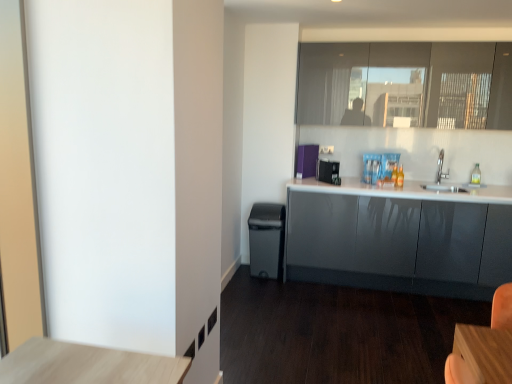
Find the location of `matte black trash can at lower center`. matte black trash can at lower center is located at coordinates (266, 240).

In order to face transparent plastic bottle at right, should I rotate leftwards or rightwards?

Rotate right and turn 27.560 degrees.

Where is `glossy gray cabinets at right`? glossy gray cabinets at right is located at coordinates (399, 238).

What do you see at coordinates (329, 171) in the screenshot? I see `black plastic toaster at center, the second appliance in the back-to-front sequence` at bounding box center [329, 171].

What is the approximate width of silver metallic sink at upper right?

11.90 inches.

This screenshot has height=384, width=512. What do you see at coordinates (442, 178) in the screenshot? I see `silver metallic sink at upper right` at bounding box center [442, 178].

Locate an element on the screen. The image size is (512, 384). matte black trash can at lower center is located at coordinates (266, 240).

Is black plastic toaster at center, the second appliance in the back-to-front sequence, placed right next to silver metallic sink at upper right?

black plastic toaster at center, the second appliance in the back-to-front sequence, is not next to silver metallic sink at upper right, and they're not touching.

Who is shorter, black plastic toaster at center, the second appliance in the back-to-front sequence, or silver metallic sink at upper right?

black plastic toaster at center, the second appliance in the back-to-front sequence, is shorter.

How much distance is there between black plastic toaster at center, the second appliance in the back-to-front sequence, and silver metallic sink at upper right?

They are 36.63 inches apart.

Would you say black plastic toaster at center, the second appliance in the back-to-front sequence, is outside silver metallic sink at upper right?

Yes.

This screenshot has height=384, width=512. Identify the location of appliance that is the 1st one when counting upward from the glossy gray cabinets at right (from the image's perspective). (329, 171).

In terms of width, does glossy gray cabinets at right look wider or thinner when compared to black plastic toaster at center, the second appliance in the back-to-front sequence?

glossy gray cabinets at right is wider than black plastic toaster at center, the second appliance in the back-to-front sequence.

Is the position of glossy gray cabinets at right more distant than that of black plastic toaster at center, the second appliance in the back-to-front sequence?

No, the depth of glossy gray cabinets at right is less than that of black plastic toaster at center, the second appliance in the back-to-front sequence.

Locate an element on the screen. Image resolution: width=512 pixels, height=384 pixels. dish washer below the silver metallic sink at upper right (from the image's perspective) is located at coordinates (266, 240).

Which point is more forward, (283,225) or (441,161)?

Point (283,225)

Who is taller, matte black trash can at lower center or silver metallic sink at upper right?

matte black trash can at lower center.

Measure the distance from purple fabric at upper center, positioned as the 2th appliance in front-to-back order, to matte glass window at upper right.

A distance of 37.42 inches exists between purple fabric at upper center, positioned as the 2th appliance in front-to-back order, and matte glass window at upper right.

From the picture: Which object is closer to the camera, purple fabric at upper center, which ranks as the 1th appliance in back-to-front order, or matte glass window at upper right?

matte glass window at upper right is in front.

Which object is thinner, purple fabric at upper center, positioned as the 2th appliance in front-to-back order, or matte glass window at upper right?

With smaller width is purple fabric at upper center, positioned as the 2th appliance in front-to-back order.

From a real-world perspective, who is located lower, purple fabric at upper center, which ranks as the 1th appliance in back-to-front order, or matte glass window at upper right?

purple fabric at upper center, which ranks as the 1th appliance in back-to-front order.

Could you tell me if matte glass window at upper right is turned towards glossy gray cabinets at right?

No, matte glass window at upper right is not facing towards glossy gray cabinets at right.

Which is more distant, (355, 71) or (354, 215)?

Positioned behind is point (355, 71).

Where is `cabinetry below the matte glass window at upper right (from the image's perspective)`? This screenshot has height=384, width=512. cabinetry below the matte glass window at upper right (from the image's perspective) is located at coordinates (399, 238).

From the image's perspective, which is below, matte glass window at upper right or glossy gray cabinets at right?

From the image's view, glossy gray cabinets at right is below.

From a real-world perspective, is black plastic toaster at center, the first appliance viewed from the front, located beneath glossy gray cabinets at right?

No, from a real-world perspective, black plastic toaster at center, the first appliance viewed from the front, is not beneath glossy gray cabinets at right.

How many degrees apart are the facing directions of black plastic toaster at center, the second appliance in the back-to-front sequence, and glossy gray cabinets at right?

black plastic toaster at center, the second appliance in the back-to-front sequence, and glossy gray cabinets at right are facing 40.7 degrees away from each other.

Considering the relative positions of black plastic toaster at center, the second appliance in the back-to-front sequence, and glossy gray cabinets at right in the image provided, is black plastic toaster at center, the second appliance in the back-to-front sequence, to the left of glossy gray cabinets at right from the viewer's perspective?

Correct, you'll find black plastic toaster at center, the second appliance in the back-to-front sequence, to the left of glossy gray cabinets at right.

Considering the points (480, 174) and (251, 229), which point is behind, point (480, 174) or point (251, 229)?

The point (251, 229) is farther from the camera.

Is transparent plastic bottle at right looking in the opposite direction of matte black trash can at lower center?

No, transparent plastic bottle at right's orientation is not away from matte black trash can at lower center.

From their relative heights in the image, would you say transparent plastic bottle at right is taller or shorter than matte black trash can at lower center?

In the image, transparent plastic bottle at right appears to be shorter than matte black trash can at lower center.

How much distance is there between transparent plastic bottle at right and matte black trash can at lower center?

transparent plastic bottle at right is 1.95 meters away from matte black trash can at lower center.

The height and width of the screenshot is (384, 512). I want to click on sink that is in front of the black plastic toaster at center, the second appliance in the back-to-front sequence, so click(x=442, y=178).

The image size is (512, 384). Find the location of `cabinetry beneath the black plastic toaster at center, the second appliance in the back-to-front sequence (from a real-world perspective)`. cabinetry beneath the black plastic toaster at center, the second appliance in the back-to-front sequence (from a real-world perspective) is located at coordinates (399, 238).

Based on the photo, which object lies further to the anchor point matte glass window at upper right, purple fabric at upper center, which ranks as the 1th appliance in back-to-front order, or black plastic toaster at center, the second appliance in the back-to-front sequence?

black plastic toaster at center, the second appliance in the back-to-front sequence.

Considering their positions, is black plastic toaster at center, the first appliance viewed from the front, positioned further to matte black trash can at lower center than glossy gray cabinets at right?

black plastic toaster at center, the first appliance viewed from the front.

Estimate the real-world distances between objects in this image. Which object is closer to matte glass window at upper right, purple fabric at upper center, positioned as the 2th appliance in front-to-back order, or transparent plastic bottle at right?

Among the two, purple fabric at upper center, positioned as the 2th appliance in front-to-back order, is located nearer to matte glass window at upper right.

Based on their spatial positions, is transparent plastic bottle at right or black plastic toaster at center, the first appliance viewed from the front, further from silver metallic sink at upper right?

black plastic toaster at center, the first appliance viewed from the front, lies further to silver metallic sink at upper right than the other object.

Considering their positions, is black plastic toaster at center, the first appliance viewed from the front, positioned further to glossy gray cabinets at right than matte black trash can at lower center?

black plastic toaster at center, the first appliance viewed from the front.

From the picture: Estimate the real-world distances between objects in this image. Which object is closer to silver metallic sink at upper right, glossy gray cabinets at right or matte glass window at upper right?

glossy gray cabinets at right.

Looking at this image, from the image, which object appears to be nearer to black plastic toaster at center, the second appliance in the back-to-front sequence, glossy gray cabinets at right or matte glass window at upper right?

glossy gray cabinets at right is closer to black plastic toaster at center, the second appliance in the back-to-front sequence.

Considering their positions, is matte black trash can at lower center positioned closer to silver metallic sink at upper right than glossy gray cabinets at right?

Among the two, glossy gray cabinets at right is located nearer to silver metallic sink at upper right.

Where is `window between matte black trash can at lower center and transparent plastic bottle at right from left to right`? This screenshot has width=512, height=384. window between matte black trash can at lower center and transparent plastic bottle at right from left to right is located at coordinates (406, 84).

Identify the location of appliance between purple fabric at upper center, positioned as the 2th appliance in front-to-back order, and glossy gray cabinets at right from left to right. (329, 171).

Find the location of a particular element. sink between matte glass window at upper right and glossy gray cabinets at right from top to bottom is located at coordinates (442, 178).

At what (x,y) coordinates should I click in order to perform the action: click on cabinetry situated between black plastic toaster at center, the first appliance viewed from the front, and silver metallic sink at upper right from left to right. Please return your answer as a coordinate pair (x, y). The width and height of the screenshot is (512, 384). Looking at the image, I should click on (399, 238).